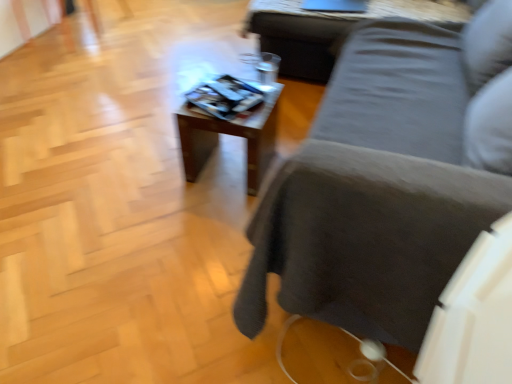
Where is `vacant area situated to the left side of wooden table at center, placed as the first table when sorted from bottom to top`? vacant area situated to the left side of wooden table at center, placed as the first table when sorted from bottom to top is located at coordinates (155, 174).